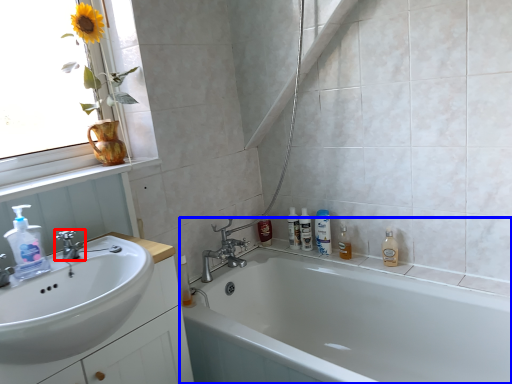
Question: Which of the following is the closest to the observer, tap (highlighted by a red box) or bathtub (highlighted by a blue box)?

Choices:
 (A) tap
 (B) bathtub

Answer: (B)